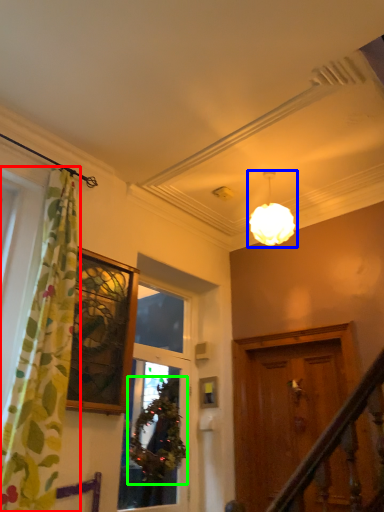
Question: Which object is positioned closest to curtain (highlighted by a red box)? Select from lamp (highlighted by a blue box) and plant (highlighted by a green box).

Choices:
 (A) lamp
 (B) plant

Answer: (B)